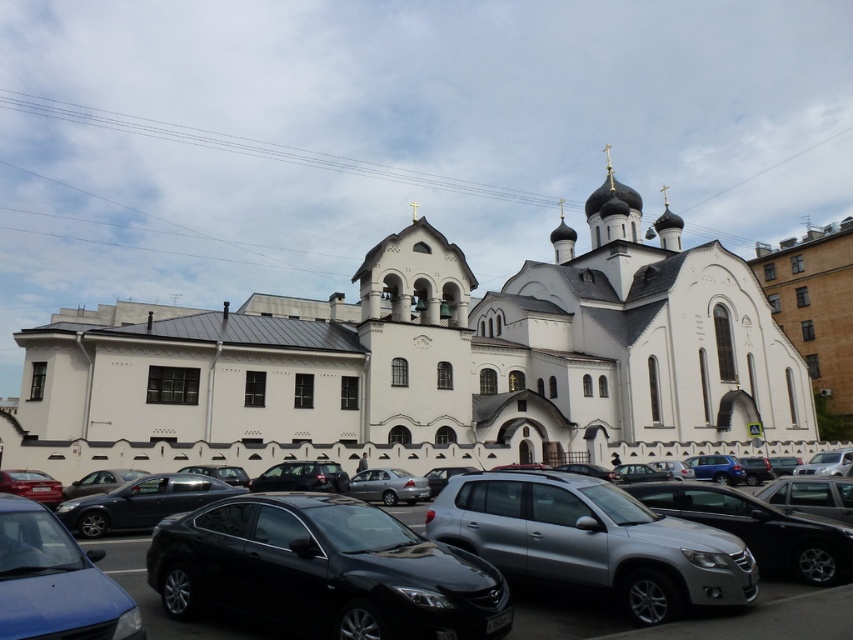
Question: Which point is farther from the camera taking this photo?

Choices:
 (A) (428, 608)
 (B) (366, 483)
 (C) (131, 506)

Answer: (B)

Question: Which of the following is the closest to the observer?

Choices:
 (A) black metallic cars at lower center
 (B) shiny red sedan at lower left
 (C) matte black sedan at lower left
 (D) satin black sedan at lower left

Answer: (C)

Question: Observing the image, what is the correct spatial positioning of matte black sedan at lower left in reference to satin black sedan at lower left?

Choices:
 (A) left
 (B) right

Answer: (B)

Question: Does silver metallic suv at center have a larger size compared to matte black sedan at lower left?

Choices:
 (A) no
 (B) yes

Answer: (B)

Question: Is white stone church at center thinner than satin black sedan at lower left?

Choices:
 (A) no
 (B) yes

Answer: (A)

Question: Which object is closer to the camera taking this photo?

Choices:
 (A) satin silver sedan at center
 (B) shiny red sedan at lower left

Answer: (B)